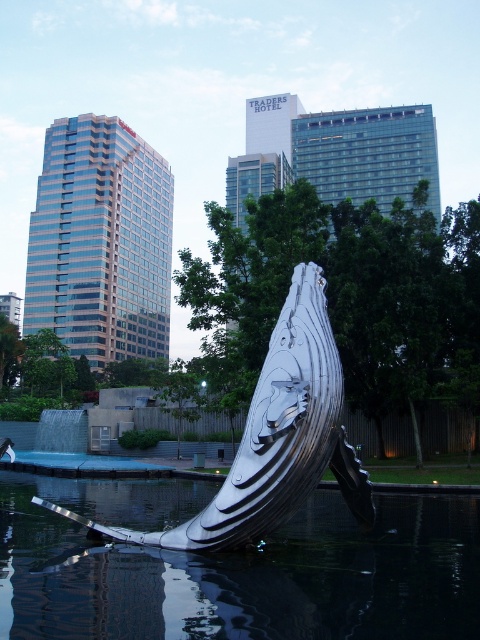
You are a drone operator trying to capture a photo of the modern sculpture of a whale. Your drone is currently hovering at point 0.889, 0.490. Is your drone currently above the metallic water at lower center?

Yes, the metallic water at lower center is located at point (x=235, y=568), so the drone is currently above the metallic water at lower center.

You are an architect designing a new plaza and want to place a bench between the metallic water at lower center and the polished silver whale at center. Since the bench requires a minimum of 2 meters of space, can the space between them accommodate it?

The metallic water at lower center is wider than the polished silver whale at center, but the description does not provide specific measurements for the distance between them. Therefore, it is unclear if the space between them is sufficient for the bench requiring 2 meters.